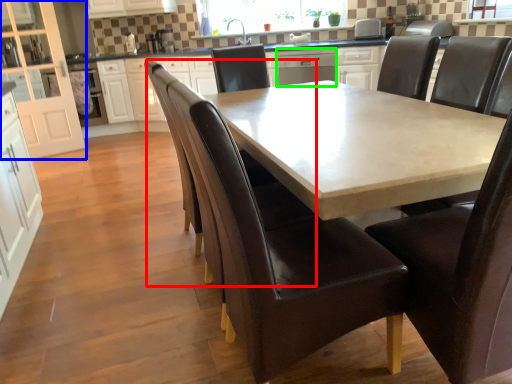
Question: Which object is the closest to the armchair (highlighted by a red box)? Choose among these: cabinetry (highlighted by a blue box) or dish washer (highlighted by a green box).

Choices:
 (A) cabinetry
 (B) dish washer

Answer: (B)